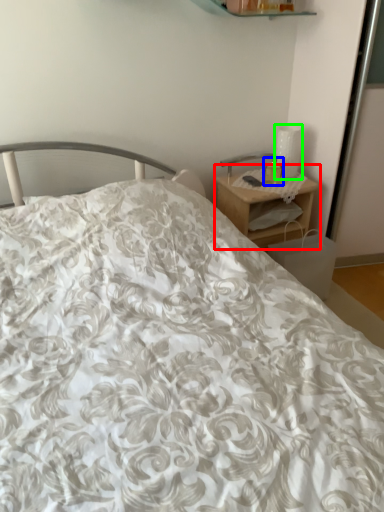
Question: Estimate the real-world distances between objects in this image. Which object is closer to nightstand (highlighted by a red box), candle holder (highlighted by a blue box) or table lamp (highlighted by a green box)?

Choices:
 (A) candle holder
 (B) table lamp

Answer: (A)